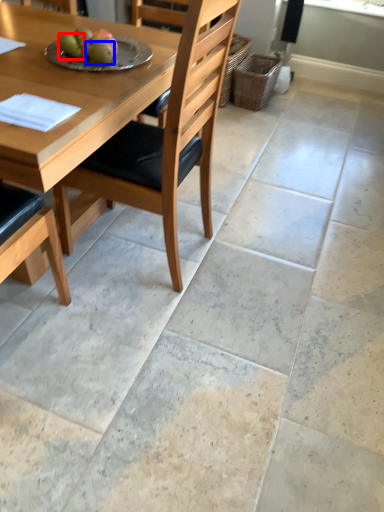
Question: Which object appears closest to the camera in this image, fruit (highlighted by a red box) or fruit (highlighted by a blue box)?

Choices:
 (A) fruit
 (B) fruit

Answer: (B)